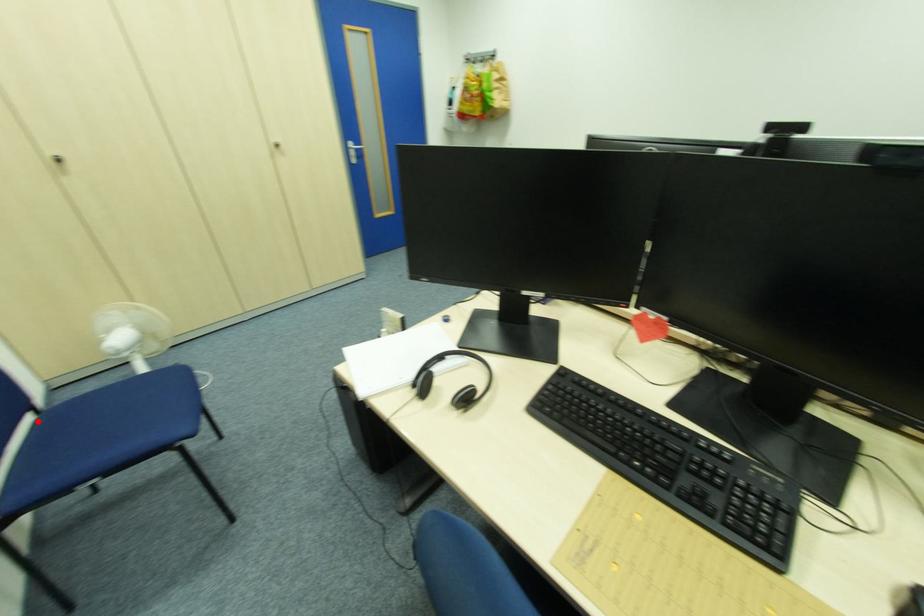
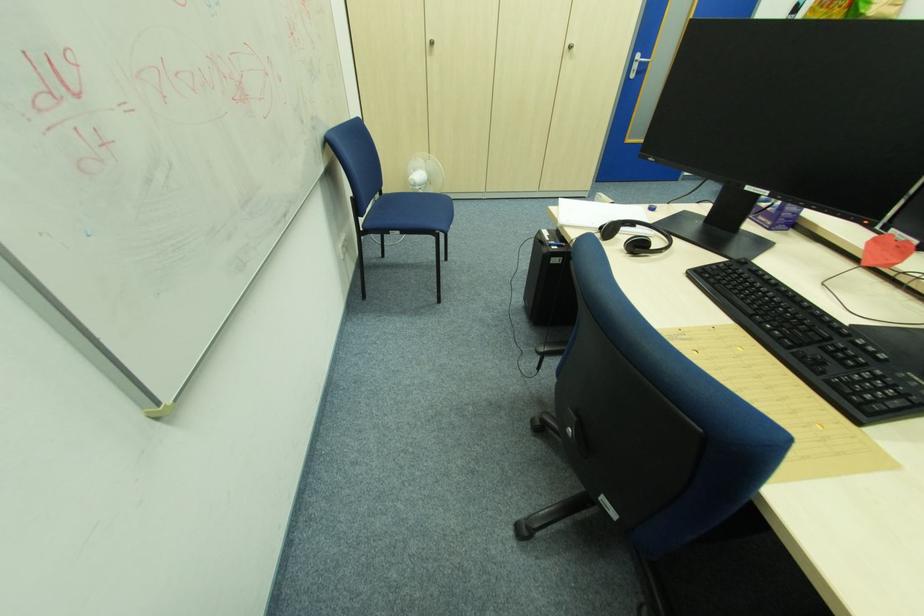
The point at the highlighted location is marked in the first image. Where is the corresponding point in the second image?

(383, 197)